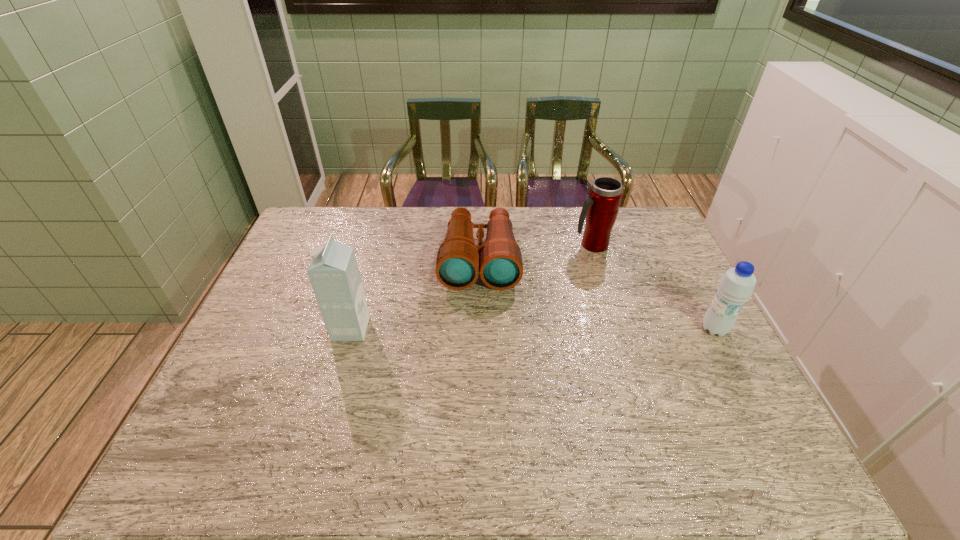
The width and height of the screenshot is (960, 540). What are the coordinates of `the tallest object` in the screenshot? It's located at (333, 272).

Locate an element on the screen. the leftmost object is located at coordinates (333, 272).

In order to click on water bottle in this screenshot , I will do `click(736, 286)`.

Where is `the third object from right to left`? The height and width of the screenshot is (540, 960). the third object from right to left is located at coordinates (457, 266).

You are a GUI agent. You are given a task and a screenshot of the screen. Output one action in this format:
    pyautogui.click(x=<x>, y=<y>)
    Task: Click on the shortest object
    This screenshot has width=960, height=540.
    Given the screenshot: What is the action you would take?
    pyautogui.click(x=457, y=266)

The height and width of the screenshot is (540, 960). Find the location of `the second object from right to left`. the second object from right to left is located at coordinates (601, 208).

I want to click on vacant space located on the front label of the leftmost object, so click(x=305, y=329).

What are the coordinates of `free region located 0.080m on the front label of the leftmost object` in the screenshot? It's located at (305, 329).

This screenshot has width=960, height=540. Identify the location of free space located 0.160m on the front label of the leftmost object. (276, 329).

I want to click on vacant space located on the left of the rightmost object, so click(613, 329).